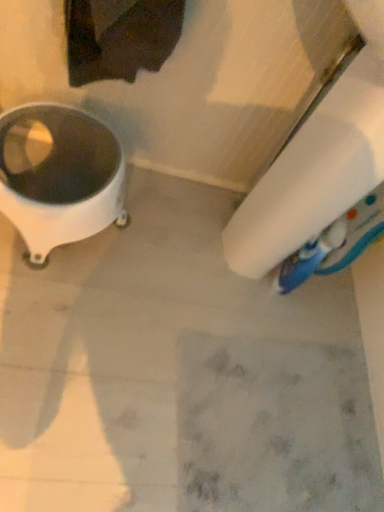
The width and height of the screenshot is (384, 512). In order to click on unoccupied region to the right of white glossy toilet paper at lower right in this screenshot , I will do `click(340, 374)`.